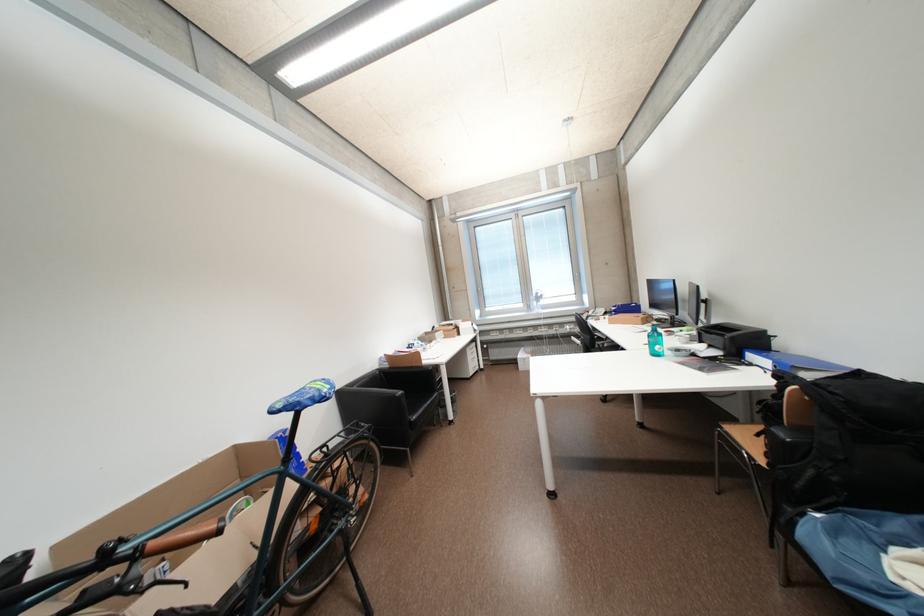
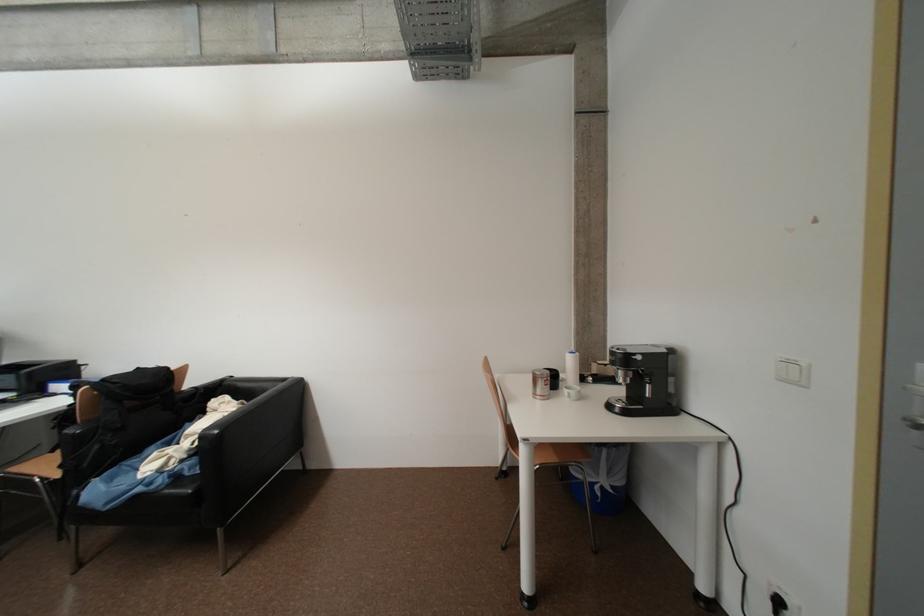
Question: The camera is either moving clockwise (left) or counter-clockwise (right) around the object. The first image is from the beginning of the video and the second image is from the end. Is the camera moving left or right when shooting the video?

Choices:
 (A) Left
 (B) Right

Answer: (A)